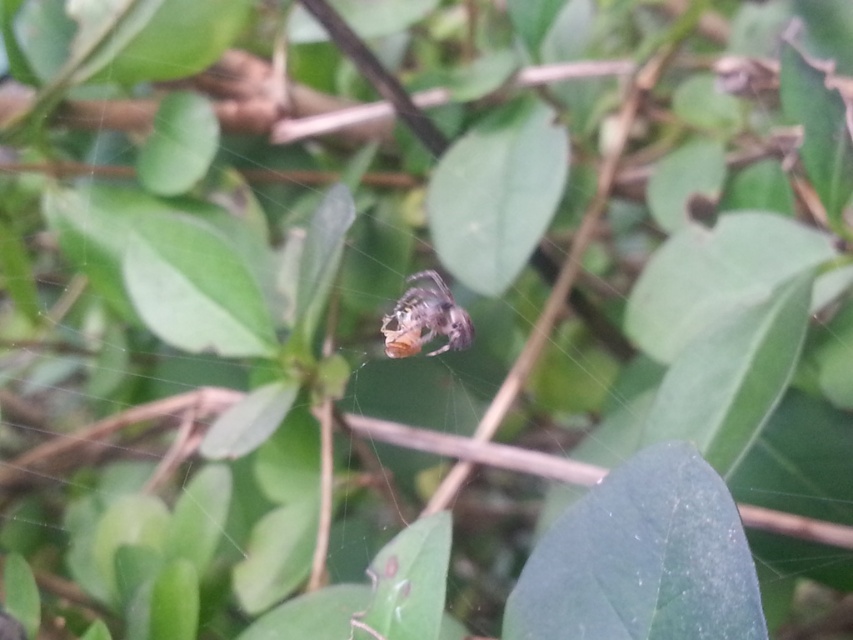
Question: Among these points, which one is nearest to the camera?

Choices:
 (A) (550, 566)
 (B) (390, 333)

Answer: (A)

Question: Which point is closer to the camera?

Choices:
 (A) (x=459, y=337)
 (B) (x=560, y=589)

Answer: (B)

Question: Does green matte leaf at center have a greater width compared to shiny metallic spider at center?

Choices:
 (A) no
 (B) yes

Answer: (B)

Question: Where is green matte leaf at center located in relation to shiny metallic spider at center in the image?

Choices:
 (A) right
 (B) left

Answer: (A)

Question: Is green matte leaf at center wider than shiny metallic spider at center?

Choices:
 (A) yes
 (B) no

Answer: (A)

Question: Which point is closer to the camera?

Choices:
 (A) shiny metallic spider at center
 (B) green matte leaf at center

Answer: (B)